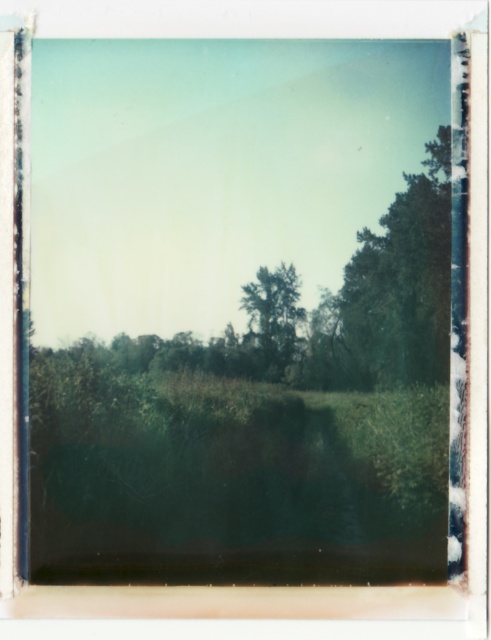
Question: Among these points, which one is nearest to the camera?

Choices:
 (A) (285, 349)
 (B) (357, 356)

Answer: (B)

Question: Is green leafy tree at upper right to the left of green leafy tree at center from the viewer's perspective?

Choices:
 (A) no
 (B) yes

Answer: (A)

Question: Considering the relative positions of green leafy tree at upper right and green leafy tree at center in the image provided, where is green leafy tree at upper right located with respect to green leafy tree at center?

Choices:
 (A) left
 (B) right

Answer: (B)

Question: Which of the following is the closest to the observer?

Choices:
 (A) (246, 294)
 (B) (438, 236)

Answer: (B)

Question: Is the position of green leafy tree at upper right more distant than that of green leafy tree at center?

Choices:
 (A) no
 (B) yes

Answer: (A)